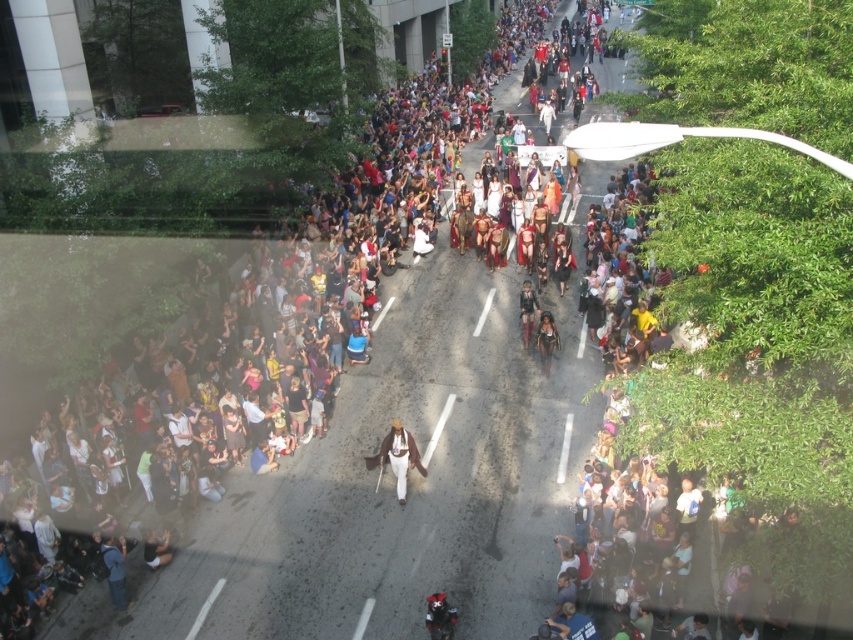
Question: Estimate the real-world distances between objects in this image. Which object is farther from the black leather motorcycle at center?

Choices:
 (A) white fur coat at center
 (B) brown leather jacket at center

Answer: (B)

Question: Is white fur coat at center positioned behind black leather motorcycle at center?

Choices:
 (A) no
 (B) yes

Answer: (B)

Question: Which of the following is the farthest from the observer?

Choices:
 (A) white fur coat at center
 (B) brown leather jacket at center
 (C) black leather motorcycle at center
 (D) leather-like costume at center

Answer: (B)

Question: Which of these objects is positioned farthest from the white fur coat at center?

Choices:
 (A) leather-like costume at center
 (B) brown leather jacket at center

Answer: (B)

Question: Does white fur coat at center appear on the right side of black leather motorcycle at center?

Choices:
 (A) yes
 (B) no

Answer: (B)

Question: Does black leather motorcycle at center have a larger size compared to leather-like costume at center?

Choices:
 (A) no
 (B) yes

Answer: (A)